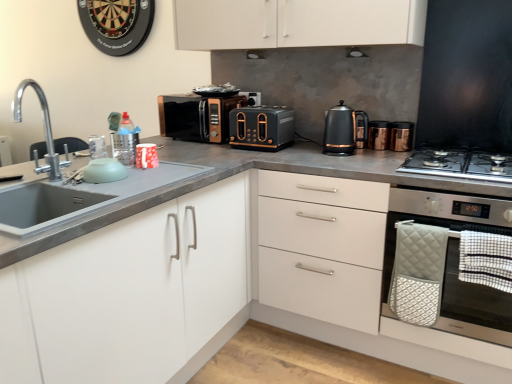
At what (x,y) coordinates should I click in order to perform the action: click on vacant region in front of metallic copper kettle at upper right, marked as the 3th appliance in a left-to-right arrangement. Please return your answer as a coordinate pair (x, y). Image resolution: width=512 pixels, height=384 pixels. Looking at the image, I should click on (387, 149).